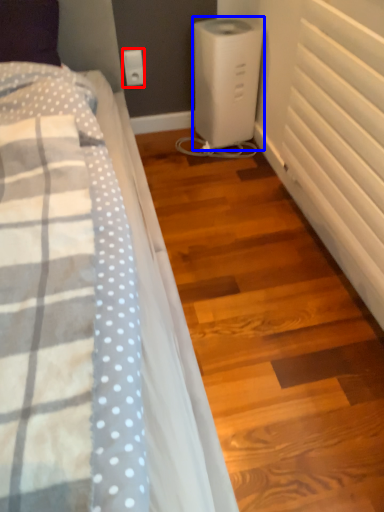
Question: Which of the following is the closest to the observer, electric outlet (highlighted by a red box) or home appliance (highlighted by a blue box)?

Choices:
 (A) electric outlet
 (B) home appliance

Answer: (B)